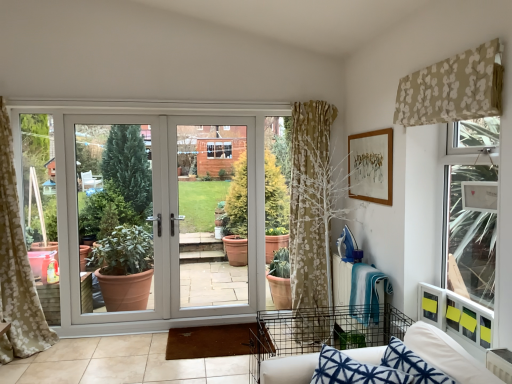
Question: From a real-world perspective, is beige floral fabric at upper right physically below blue printed fabric couch at lower right?

Choices:
 (A) yes
 (B) no

Answer: (B)

Question: From a real-world perspective, is beige floral fabric at upper right over blue printed fabric couch at lower right?

Choices:
 (A) yes
 (B) no

Answer: (A)

Question: Is there a large distance between beige floral fabric at upper right and blue printed fabric couch at lower right?

Choices:
 (A) yes
 (B) no

Answer: (A)

Question: Is beige floral fabric at upper right at the right side of blue printed fabric couch at lower right?

Choices:
 (A) no
 (B) yes

Answer: (B)

Question: Could you tell me if beige floral fabric at upper right is facing blue printed fabric couch at lower right?

Choices:
 (A) yes
 (B) no

Answer: (B)

Question: From their relative heights in the image, would you say white glossy door at center is taller or shorter than blue printed fabric couch at lower right?

Choices:
 (A) tall
 (B) short

Answer: (A)

Question: Which is correct: white glossy door at center is inside blue printed fabric couch at lower right, or outside of it?

Choices:
 (A) outside
 (B) inside

Answer: (A)

Question: Based on their sizes in the image, would you say white glossy door at center is bigger or smaller than blue printed fabric couch at lower right?

Choices:
 (A) small
 (B) big

Answer: (B)

Question: Does point (193, 162) appear closer or farther from the camera than point (311, 360)?

Choices:
 (A) farther
 (B) closer

Answer: (A)

Question: Is point (294, 382) closer or farther from the camera than point (220, 230)?

Choices:
 (A) farther
 (B) closer

Answer: (B)

Question: Relative to white plastic door at center, is blue printed fabric couch at lower right in front or behind?

Choices:
 (A) front
 (B) behind

Answer: (A)

Question: Based on their sizes in the image, would you say blue printed fabric couch at lower right is bigger or smaller than white plastic door at center?

Choices:
 (A) big
 (B) small

Answer: (B)

Question: From the image's perspective, is blue printed fabric couch at lower right above or below white plastic door at center?

Choices:
 (A) above
 (B) below

Answer: (B)

Question: Considering their positions, is blue printed fabric couch at lower right located in front of or behind beige floral fabric at upper right?

Choices:
 (A) front
 (B) behind

Answer: (A)

Question: From the image's perspective, relative to beige floral fabric at upper right, is blue printed fabric couch at lower right above or below?

Choices:
 (A) below
 (B) above

Answer: (A)